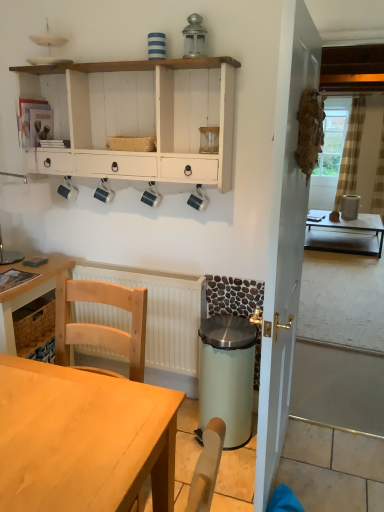
What do you see at coordinates (138, 118) in the screenshot? I see `white wood cabinet at upper center` at bounding box center [138, 118].

The width and height of the screenshot is (384, 512). What do you see at coordinates (333, 137) in the screenshot?
I see `clear glass window screen at upper right` at bounding box center [333, 137].

This screenshot has width=384, height=512. Identify the location of matte black coffee cup at lower center, which is the 2th coffee cup in right-to-left order. (198, 199).

At what (x,y) coordinates should I click in order to perform the action: click on metallic lantern at upper center. Please return your answer as a coordinate pair (x, y). This screenshot has width=384, height=512. Looking at the image, I should click on (194, 37).

Measure the distance between point (195, 41) and camera.

Point (195, 41) and camera are 1.92 meters apart.

What is the approximate height of wooden desk at left, the 1th desk positioned from the left?

It is 56.15 centimeters.

This screenshot has width=384, height=512. I want to click on white wood cabinet at upper center, so pos(138,118).

Could you tell me if matte black coffee cup at center, marked as the fourth coffee cup in a right-to-left arrangement, is turned towards white wooden door at center?

No.

Looking at their sizes, would you say matte black coffee cup at center, positioned as the 2th coffee cup in left-to-right order, is wider or thinner than white wooden door at center?

In the image, matte black coffee cup at center, positioned as the 2th coffee cup in left-to-right order, appears to be more narrow than white wooden door at center.

Between point (105, 196) and point (302, 26), which one is positioned in front?

The point (302, 26) is in front.

How different are the orientations of matte black coffee cup at center, marked as the fourth coffee cup in a right-to-left arrangement, and white wooden door at center in degrees?

The angle between the facing direction of matte black coffee cup at center, marked as the fourth coffee cup in a right-to-left arrangement, and the facing direction of white wooden door at center is 89.5 degrees.

Based on the photo, considering the positions of objects matte black coffee cup at left, which ranks as the first coffee cup in left-to-right order, and matte black coffee cup at center, which is the third coffee cup from right to left, in the image provided, who is in front, matte black coffee cup at left, which ranks as the first coffee cup in left-to-right order, or matte black coffee cup at center, which is the third coffee cup from right to left,?

Positioned in front is matte black coffee cup at center, which is the third coffee cup from right to left.

From the image's perspective, between matte black coffee cup at left, which ranks as the first coffee cup in left-to-right order, and matte black coffee cup at center, which is the third coffee cup from right to left, who is located below?

matte black coffee cup at center, which is the third coffee cup from right to left, from the image's perspective.

Is matte black coffee cup at left, which ranks as the first coffee cup in left-to-right order, inside or outside of matte black coffee cup at center, which is the 3th coffee cup from left to right?

matte black coffee cup at left, which ranks as the first coffee cup in left-to-right order, is outside matte black coffee cup at center, which is the 3th coffee cup from left to right.

Consider the image. Who is taller, light wood chair at left or light green plastic trash can at lower center?

With more height is light wood chair at left.

Is there a large distance between light wood chair at left and light green plastic trash can at lower center?

That's not correct — light wood chair at left is a little close to light green plastic trash can at lower center.

Who is bigger, light wood chair at left or light green plastic trash can at lower center?

light wood chair at left.

Which object is wider, white plastic radiator at lower center or wooden desk at left, which appears as the 2th desk when viewed from the front?

wooden desk at left, which appears as the 2th desk when viewed from the front.

Where is `desk that is on the left side of white plastic radiator at lower center`? This screenshot has height=512, width=384. desk that is on the left side of white plastic radiator at lower center is located at coordinates (28, 293).

Which object is closer to the camera, white plastic radiator at lower center or wooden desk at left, which appears as the 2th desk when viewed from the front?

wooden desk at left, which appears as the 2th desk when viewed from the front, is more forward.

Is white plastic radiator at lower center far away from wooden desk at left, the 1th desk positioned from the left?

That's not correct — white plastic radiator at lower center is a little close to wooden desk at left, the 1th desk positioned from the left.

From a real-world perspective, does clear glass coffee cup at upper center, placed as the 5th coffee cup when sorted from left to right, sit lower than clear glass window screen at upper right?

No, from a real-world perspective, clear glass coffee cup at upper center, placed as the 5th coffee cup when sorted from left to right, is not under clear glass window screen at upper right.

Considering the points (211, 134) and (336, 103), which point is behind, point (211, 134) or point (336, 103)?

The point (336, 103) is farther from the camera.

Considering the sizes of objects clear glass coffee cup at upper center, the first coffee cup in the right-to-left sequence, and clear glass window screen at upper right in the image provided, who is shorter, clear glass coffee cup at upper center, the first coffee cup in the right-to-left sequence, or clear glass window screen at upper right?

With less height is clear glass coffee cup at upper center, the first coffee cup in the right-to-left sequence.

How many degrees apart are the facing directions of clear glass coffee cup at upper center, the first coffee cup in the right-to-left sequence, and clear glass window screen at upper right?

The angular difference between clear glass coffee cup at upper center, the first coffee cup in the right-to-left sequence, and clear glass window screen at upper right is 3.15 degrees.

Looking at the image, does light green plastic trash can at lower center seem bigger or smaller compared to wooden desk at left, arranged as the 2th desk when viewed from the right?

Clearly, light green plastic trash can at lower center is smaller in size than wooden desk at left, arranged as the 2th desk when viewed from the right.

Is light green plastic trash can at lower center inside or outside of wooden desk at left, which is counted as the first desk, starting from the back?

The correct answer is: outside.

Is light green plastic trash can at lower center in front of wooden desk at left, which is counted as the first desk, starting from the back?

No, light green plastic trash can at lower center is behind wooden desk at left, which is counted as the first desk, starting from the back.

Is light green plastic trash can at lower center facing towards wooden desk at left, the 1th desk positioned from the left?

No, light green plastic trash can at lower center does not turn towards wooden desk at left, the 1th desk positioned from the left.

Looking at this image, from the image's perspective, is white wooden door at center located beneath matte black coffee cup at center, positioned as the 2th coffee cup in left-to-right order?

Yes.

Considering the relative positions of white wooden door at center and matte black coffee cup at center, positioned as the 2th coffee cup in left-to-right order, in the image provided, is white wooden door at center in front of matte black coffee cup at center, positioned as the 2th coffee cup in left-to-right order,?

Yes.

Is white wooden door at center to the left or to the right of matte black coffee cup at center, marked as the fourth coffee cup in a right-to-left arrangement, in the image?

From the image, it's evident that white wooden door at center is to the right of matte black coffee cup at center, marked as the fourth coffee cup in a right-to-left arrangement.

Locate an element on the screen. This screenshot has height=512, width=384. coffee cup that is the 3rd one when counting upward from the white wooden door at center (from the image's perspective) is located at coordinates (104, 192).

Starting from the matte black coffee cup at left, which ranks as the first coffee cup in left-to-right order, which coffee cup is the 2nd one to the right? Please provide its 2D coordinates.

[(151, 195)]

Estimate the real-world distances between objects in this image. Which object is closer to wooden desk at left, which is counted as the first desk, starting from the back, matte black coffee cup at center, marked as the fourth coffee cup in a right-to-left arrangement, or matte black coffee cup at center, which is the 3th coffee cup from left to right?

matte black coffee cup at center, marked as the fourth coffee cup in a right-to-left arrangement.

Looking at the image, which one is located further to white plastic radiator at lower center, white wood cabinet at upper center or matte black coffee cup at center, positioned as the 2th coffee cup in left-to-right order?

white wood cabinet at upper center is positioned further to the anchor white plastic radiator at lower center.

In the scene shown: From the image, which object appears to be nearer to wooden desk at left, the 1th desk positioned from the left, light green plastic trash can at lower center or white wooden door at center?

The object closer to wooden desk at left, the 1th desk positioned from the left, is light green plastic trash can at lower center.

Consider the image. Considering their positions, is wooden desk at left, arranged as the 2th desk when viewed from the right, positioned further to white wooden door at center than wooden table at center?

wooden table at center lies further to white wooden door at center than the other object.

From the image, which object appears to be nearer to matte black coffee cup at lower center, which is the 2th coffee cup in right-to-left order, white wood cabinet at upper center or light wood chair at left?

white wood cabinet at upper center is closer to matte black coffee cup at lower center, which is the 2th coffee cup in right-to-left order.

Looking at this image, considering their positions, is matte black coffee cup at center, which is the 3th coffee cup from left to right, positioned closer to light green plastic trash can at lower center than matte black coffee cup at center, marked as the fourth coffee cup in a right-to-left arrangement?

The object closer to light green plastic trash can at lower center is matte black coffee cup at center, which is the 3th coffee cup from left to right.

Considering their positions, is white wood cabinet at upper center positioned closer to matte black coffee cup at center, which is the third coffee cup from right to left, than clear glass coffee cup at upper center, the first coffee cup in the right-to-left sequence?

clear glass coffee cup at upper center, the first coffee cup in the right-to-left sequence, is closer to matte black coffee cup at center, which is the third coffee cup from right to left.

When comparing their distances from light wood chair at left, does wooden desk at left, arranged as the 2th desk when viewed from the right, or clear glass window screen at upper right seem closer?

wooden desk at left, arranged as the 2th desk when viewed from the right.

Find the location of a particular element. This screenshot has width=384, height=512. radiator positioned between light wood chair at left and matte black coffee cup at left, which ranks as the first coffee cup in left-to-right order, from near to far is located at coordinates (161, 312).

You are a GUI agent. You are given a task and a screenshot of the screen. Output one action in this format:
    pyautogui.click(x=<x>, y=<y>)
    Task: Click on the trash bin/can between white wooden door at center and wooden table at center along the z-axis
    The width and height of the screenshot is (384, 512).
    Given the screenshot: What is the action you would take?
    pyautogui.click(x=227, y=375)

You are a GUI agent. You are given a task and a screenshot of the screen. Output one action in this format:
    pyautogui.click(x=<x>, y=<y>)
    Task: Click on the chair positioned between wooden desk at lower left, the first desk from the front, and wooden table at center from near to far
    Image resolution: width=384 pixels, height=512 pixels.
    Given the screenshot: What is the action you would take?
    pyautogui.click(x=101, y=325)

This screenshot has height=512, width=384. What are the coordinates of `trash bin/can positioned between wooden desk at left, the 1th desk positioned from the left, and clear glass window screen at upper right from near to far` in the screenshot? It's located at (227, 375).